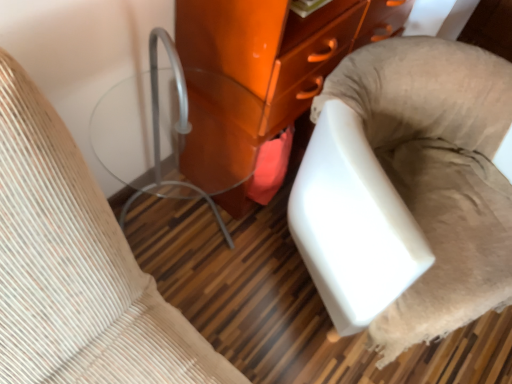
Question: Does glossy orange cabinet at center, the 2th furniture viewed from the left, have a greater height compared to white fabric chair at lower right, positioned as the 3th furniture in left-to-right order?

Choices:
 (A) yes
 (B) no

Answer: (A)

Question: Is glossy orange cabinet at center, which is the second furniture in right-to-left order, beside white fabric chair at lower right, acting as the first furniture starting from the right?

Choices:
 (A) yes
 (B) no

Answer: (B)

Question: Can you confirm if glossy orange cabinet at center, which is the second furniture in right-to-left order, is wider than white fabric chair at lower right, acting as the first furniture starting from the right?

Choices:
 (A) yes
 (B) no

Answer: (B)

Question: Could you tell me if glossy orange cabinet at center, which is the second furniture in right-to-left order, is turned towards white fabric chair at lower right, positioned as the 3th furniture in left-to-right order?

Choices:
 (A) no
 (B) yes

Answer: (B)

Question: From the image's perspective, is glossy orange cabinet at center, the 2th furniture viewed from the left, below white fabric chair at lower right, positioned as the 3th furniture in left-to-right order?

Choices:
 (A) no
 (B) yes

Answer: (A)

Question: Can you confirm if glossy orange cabinet at center, which is the second furniture in right-to-left order, is thinner than white fabric chair at lower right, acting as the first furniture starting from the right?

Choices:
 (A) yes
 (B) no

Answer: (A)

Question: Does white fabric chair at lower right, positioned as the 3th furniture in left-to-right order, come behind glossy orange cabinet at center, the 2th furniture viewed from the left?

Choices:
 (A) no
 (B) yes

Answer: (A)

Question: Can you confirm if white fabric chair at lower right, positioned as the 3th furniture in left-to-right order, is positioned to the right of glossy orange cabinet at center, which is the second furniture in right-to-left order?

Choices:
 (A) no
 (B) yes

Answer: (B)

Question: Considering the relative sizes of white fabric chair at lower right, acting as the first furniture starting from the right, and glossy orange cabinet at center, the 2th furniture viewed from the left, in the image provided, is white fabric chair at lower right, acting as the first furniture starting from the right, smaller than glossy orange cabinet at center, the 2th furniture viewed from the left,?

Choices:
 (A) yes
 (B) no

Answer: (A)

Question: Are white fabric chair at lower right, positioned as the 3th furniture in left-to-right order, and glossy orange cabinet at center, the 2th furniture viewed from the left, far apart?

Choices:
 (A) no
 (B) yes

Answer: (A)

Question: Is glossy orange cabinet at center, which is the second furniture in right-to-left order, inside white fabric chair at lower right, acting as the first furniture starting from the right?

Choices:
 (A) no
 (B) yes

Answer: (A)

Question: Is white fabric chair at lower right, positioned as the 3th furniture in left-to-right order, closer to the viewer compared to glossy orange cabinet at center, the 2th furniture viewed from the left?

Choices:
 (A) yes
 (B) no

Answer: (A)

Question: Does white fabric chair at lower right, acting as the first furniture starting from the right, lie behind matte glass side table at left, which is counted as the 3th furniture, starting from the right?

Choices:
 (A) yes
 (B) no

Answer: (A)